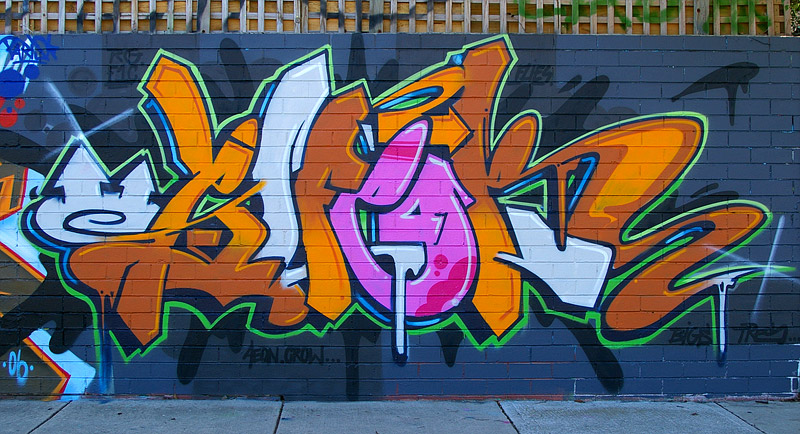
Locate an element on the screen. This screenshot has width=800, height=434. blue brick wall is located at coordinates (109, 62), (652, 57), (776, 128), (534, 346), (157, 376).